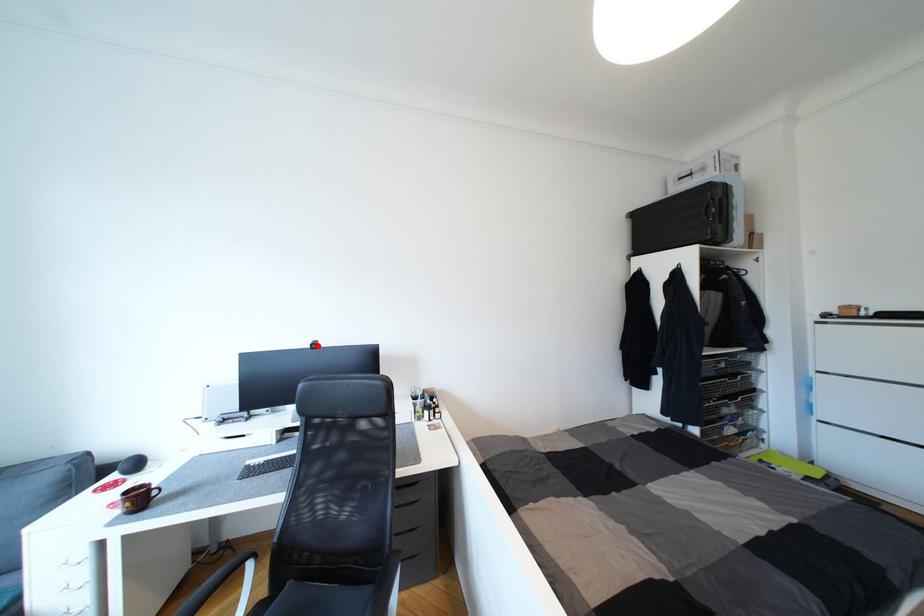
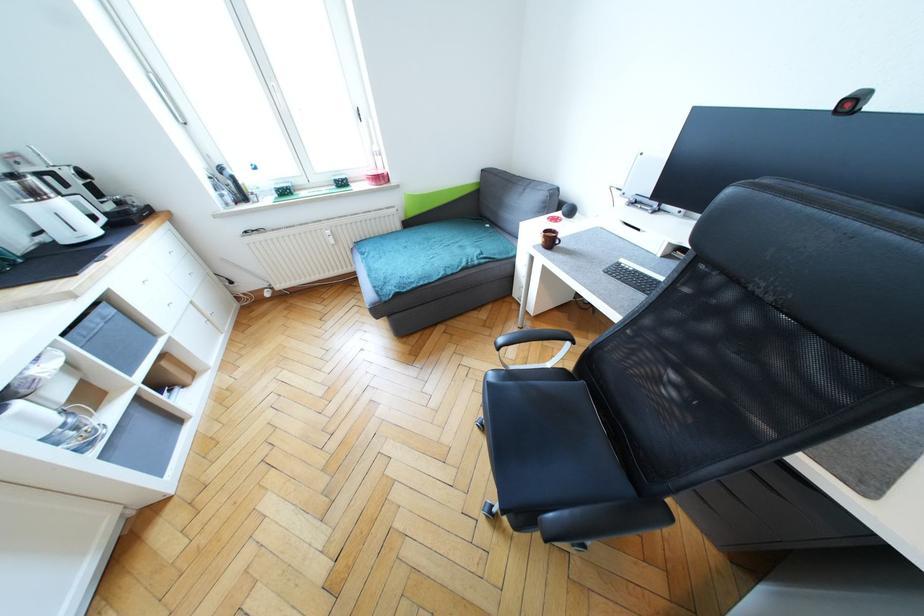
Find the pixel in the second image that matches the highlighted location in the first image.

(857, 103)